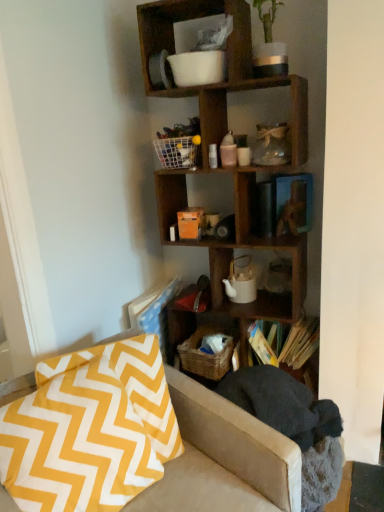
Image resolution: width=384 pixels, height=512 pixels. Describe the element at coordinates (76, 444) in the screenshot. I see `yellow zigzag fabric pillow at lower left, arranged as the second pillow when viewed from the back` at that location.

Where is `white mesh basket at upper center`? The image size is (384, 512). white mesh basket at upper center is located at coordinates 171,112.

The image size is (384, 512). What do you see at coordinates (223, 459) in the screenshot?
I see `yellow and white zigzag fabric at lower left` at bounding box center [223, 459].

The image size is (384, 512). What are the coordinates of `wooden shelf at upper center` in the screenshot? It's located at (228, 69).

From a real-world perspective, is white mesh basket at upper center located beneath yellow zigzag fabric pillow at lower left, which is the 1th pillow from back to front?

No, from a real-world perspective, white mesh basket at upper center is not below yellow zigzag fabric pillow at lower left, which is the 1th pillow from back to front.

Are white mesh basket at upper center and yellow zigzag fabric pillow at lower left, the second pillow viewed from the front, far apart?

That's right, there is a large distance between white mesh basket at upper center and yellow zigzag fabric pillow at lower left, the second pillow viewed from the front.

Is white mesh basket at upper center turned away from yellow zigzag fabric pillow at lower left, which is the 1th pillow from back to front?

No, yellow zigzag fabric pillow at lower left, which is the 1th pillow from back to front, is not at the back of white mesh basket at upper center.

Identify the location of the 2nd pillow below the woven brown basket at lower center (from the image's perspective). This screenshot has height=512, width=384. (76, 444).

Is yellow zigzag fabric pillow at lower left, which appears as the 1th pillow when viewed from the front, oriented away from woven brown basket at lower center?

That's not correct — yellow zigzag fabric pillow at lower left, which appears as the 1th pillow when viewed from the front, is not looking away from woven brown basket at lower center.

Considering the points (18, 431) and (212, 368), which point is behind, point (18, 431) or point (212, 368)?

The point (212, 368) is more distant.

Is yellow zigzag fabric pillow at lower left, arranged as the second pillow when viewed from the back, at the left side of woven brown basket at lower center?

Correct, you'll find yellow zigzag fabric pillow at lower left, arranged as the second pillow when viewed from the back, to the left of woven brown basket at lower center.

Considering the relative positions of yellow zigzag fabric pillow at lower left, arranged as the second pillow when viewed from the back, and wooden shelf at upper center in the image provided, is yellow zigzag fabric pillow at lower left, arranged as the second pillow when viewed from the back, in front of wooden shelf at upper center?

Yes, the depth of yellow zigzag fabric pillow at lower left, arranged as the second pillow when viewed from the back, is less than that of wooden shelf at upper center.

Does point (36, 409) lie behind point (222, 85)?

No, (36, 409) is closer to viewer.

From the wooden shelf at upper center, count the 2nd pillow to the left and point to it. Please provide its 2D coordinates.

[(76, 444)]

Based on the photo, considering the sizes of objects yellow zigzag fabric pillow at lower left, arranged as the second pillow when viewed from the back, and wooden shelf at upper center in the image provided, who is wider, yellow zigzag fabric pillow at lower left, arranged as the second pillow when viewed from the back, or wooden shelf at upper center?

wooden shelf at upper center is wider.

In the image, is hardcover books at center positioned in front of or behind wooden shelf at upper center?

Visually, hardcover books at center is located behind wooden shelf at upper center.

Does hardcover books at center appear on the right side of wooden shelf at upper center?

Yes.

Is hardcover books at center positioned beyond the bounds of wooden shelf at upper center?

Actually, hardcover books at center is within wooden shelf at upper center.

Is hardcover books at center looking in the opposite direction of wooden shelf at upper center?

Yes, wooden shelf at upper center is at the back of hardcover books at center.

Is point (201, 337) positioned behind point (116, 384)?

Yes.

Is woven brown basket at lower center oriented towards yellow zigzag fabric pillow at lower left, which appears as the 1th pillow when viewed from the front?

Yes, woven brown basket at lower center is turned towards yellow zigzag fabric pillow at lower left, which appears as the 1th pillow when viewed from the front.

Considering the sizes of objects woven brown basket at lower center and yellow zigzag fabric pillow at lower left, arranged as the second pillow when viewed from the back, in the image provided, who is thinner, woven brown basket at lower center or yellow zigzag fabric pillow at lower left, arranged as the second pillow when viewed from the back,?

Thinner between the two is yellow zigzag fabric pillow at lower left, arranged as the second pillow when viewed from the back.

Considering the positions of points (42, 380) and (102, 477), is point (42, 380) closer to camera compared to point (102, 477)?

No, (42, 380) is further to viewer.

Are yellow zigzag fabric pillow at lower left, which is the 1th pillow from back to front, and yellow zigzag fabric pillow at lower left, arranged as the second pillow when viewed from the back, far apart?

yellow zigzag fabric pillow at lower left, which is the 1th pillow from back to front, is near yellow zigzag fabric pillow at lower left, arranged as the second pillow when viewed from the back, not far away.

Does yellow zigzag fabric pillow at lower left, the second pillow viewed from the front, turn towards yellow zigzag fabric pillow at lower left, arranged as the second pillow when viewed from the back?

Yes, yellow zigzag fabric pillow at lower left, the second pillow viewed from the front, is turned towards yellow zigzag fabric pillow at lower left, arranged as the second pillow when viewed from the back.

Between yellow zigzag fabric pillow at lower left, which is the 1th pillow from back to front, and yellow zigzag fabric pillow at lower left, which appears as the 1th pillow when viewed from the front, which one appears on the right side from the viewer's perspective?

yellow zigzag fabric pillow at lower left, which is the 1th pillow from back to front.

Is yellow zigzag fabric pillow at lower left, which is the 1th pillow from back to front, surrounded by yellow and white zigzag fabric at lower left?

Yes, yellow zigzag fabric pillow at lower left, which is the 1th pillow from back to front, is inside yellow and white zigzag fabric at lower left.

Looking at this image, is yellow and white zigzag fabric at lower left bigger than yellow zigzag fabric pillow at lower left, the second pillow viewed from the front?

Indeed, yellow and white zigzag fabric at lower left has a larger size compared to yellow zigzag fabric pillow at lower left, the second pillow viewed from the front.

Is yellow and white zigzag fabric at lower left turned away from yellow zigzag fabric pillow at lower left, which is the 1th pillow from back to front?

Yes, yellow and white zigzag fabric at lower left is positioned with its back facing yellow zigzag fabric pillow at lower left, which is the 1th pillow from back to front.

What are the coordinates of `cabinet that appears above the yellow zigzag fabric pillow at lower left, which is the 1th pillow from back to front (from a real-world perspective)` in the screenshot? It's located at (171, 112).

This screenshot has height=512, width=384. Identify the location of the 2nd pillow counting from the left side of the woven brown basket at lower center. (76, 444).

Looking at this image, estimate the real-world distances between objects in this image. Which object is further from yellow zigzag fabric pillow at lower left, which is the 1th pillow from back to front, wooden shelf at upper center or woven brown basket at lower center?

wooden shelf at upper center is further to yellow zigzag fabric pillow at lower left, which is the 1th pillow from back to front.

Which object lies further to the anchor point yellow zigzag fabric pillow at lower left, which is the 1th pillow from back to front, white mesh basket at upper center or hardcover books at center?

Among the two, white mesh basket at upper center is located further to yellow zigzag fabric pillow at lower left, which is the 1th pillow from back to front.

From the image, which object appears to be nearer to hardcover books at center, yellow zigzag fabric pillow at lower left, the second pillow viewed from the front, or woven brown basket at lower center?

The object closer to hardcover books at center is woven brown basket at lower center.

When comparing their distances from yellow zigzag fabric pillow at lower left, the second pillow viewed from the front, does yellow zigzag fabric pillow at lower left, which appears as the 1th pillow when viewed from the front, or white mesh basket at upper center seem further?

white mesh basket at upper center is positioned further to the anchor yellow zigzag fabric pillow at lower left, the second pillow viewed from the front.

Looking at this image, from the image, which object appears to be nearer to white mesh basket at upper center, wooden shelf at upper center or hardcover books at center?

wooden shelf at upper center is positioned closer to the anchor white mesh basket at upper center.

Based on their spatial positions, is yellow zigzag fabric pillow at lower left, the second pillow viewed from the front, or hardcover books at center further from woven brown basket at lower center?

yellow zigzag fabric pillow at lower left, the second pillow viewed from the front, is positioned further to the anchor woven brown basket at lower center.

Which object lies nearer to the anchor point white mesh basket at upper center, yellow and white zigzag fabric at lower left or woven brown basket at lower center?

woven brown basket at lower center.

Based on their spatial positions, is woven brown basket at lower center or yellow and white zigzag fabric at lower left further from hardcover books at center?

yellow and white zigzag fabric at lower left is further to hardcover books at center.

I want to click on shelf between white mesh basket at upper center and woven brown basket at lower center in the vertical direction, so click(x=228, y=69).

Where is `book positioned between yellow zigzag fabric pillow at lower left, arranged as the second pillow when viewed from the back, and woven brown basket at lower center from near to far`? book positioned between yellow zigzag fabric pillow at lower left, arranged as the second pillow when viewed from the back, and woven brown basket at lower center from near to far is located at coordinates (285, 342).

At what (x,y) coordinates should I click in order to perform the action: click on shelf between white mesh basket at upper center and hardcover books at center in the up-down direction. Please return your answer as a coordinate pair (x, y). The height and width of the screenshot is (512, 384). Looking at the image, I should click on (228, 69).

The width and height of the screenshot is (384, 512). I want to click on shelf between yellow zigzag fabric pillow at lower left, which appears as the 1th pillow when viewed from the front, and hardcover books at center, so click(228, 69).